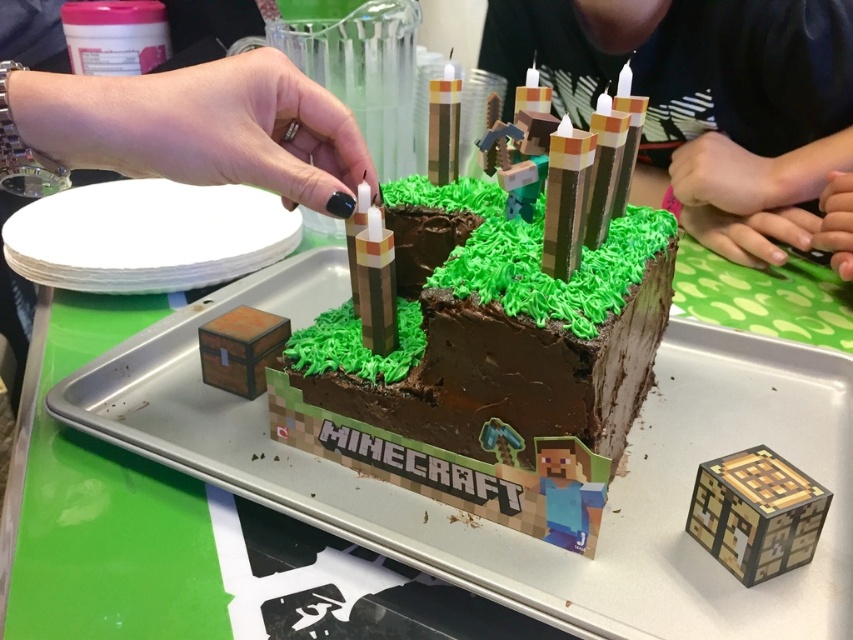
You are a guest at a Minecraft themed birthday party and want to know where the chocolate matte block at center is located relative to the smooth brown cake at center. Can you tell me?

The chocolate matte block at center is located below the smooth brown cake at center.

You are holding a 15 inch ruler and want to measure the distance between the chocolate matte block at center and the camera. Can you do it with the ruler?

The distance between the chocolate matte block at center and the camera is 18.37 inches. Since the ruler is only 15 inches long, it cannot measure the full distance. You would need a longer ruler or measuring tool to accurately measure the distance between the chocolate matte block at center and the camera.